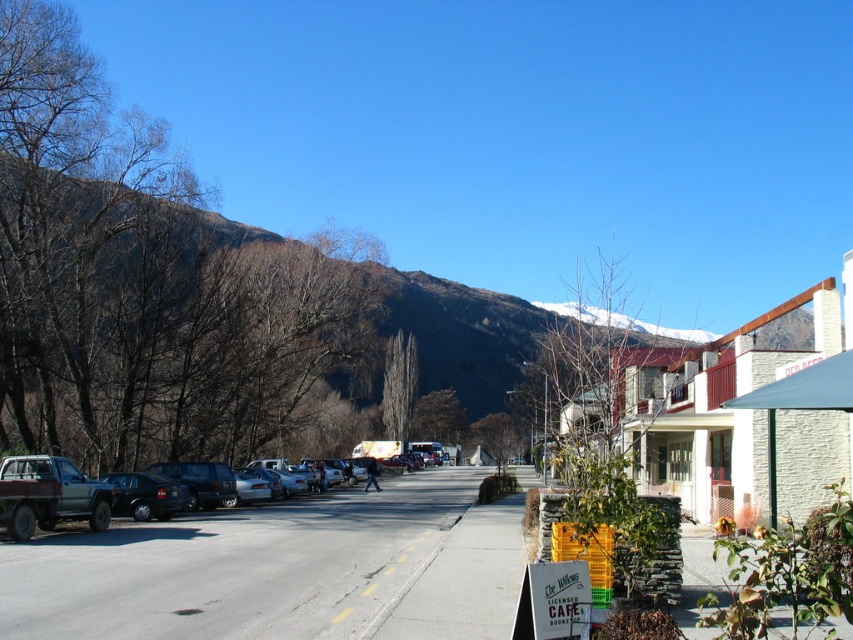
You are a tourist standing on the sidewalk in front of The Willows Cafe. You want to take a photo of the brown textured mountain at upper left and the rustic wood pickup truck at left in the same frame. Which object should you position closer to the camera to include both in your photo?

You should position the rustic wood pickup truck at left closer to the camera because the brown textured mountain at upper left is already closer to the viewer than the rustic wood pickup truck at left, so moving the truck forward would help both fit in the frame.

Based on the photo, you are a delivery driver who needs to park your truck next to the white stone building at center. The parking space available is exactly the same width as the rustic wood pickup truck at left. Will your truck fit in this space?

The white stone building at center is wider than the rustic wood pickup truck at left. Since the parking space matches the truck width, the truck may not fit if the space is only as wide as the truck itself. However, the building width is irrelevant to the parking space dimensions. The answer should focus on the truck and space width. The correct answer is yes, the truck will fit because the space is exactly the truck width. The building width comparison is a distractor. However, according to the Objects_D,